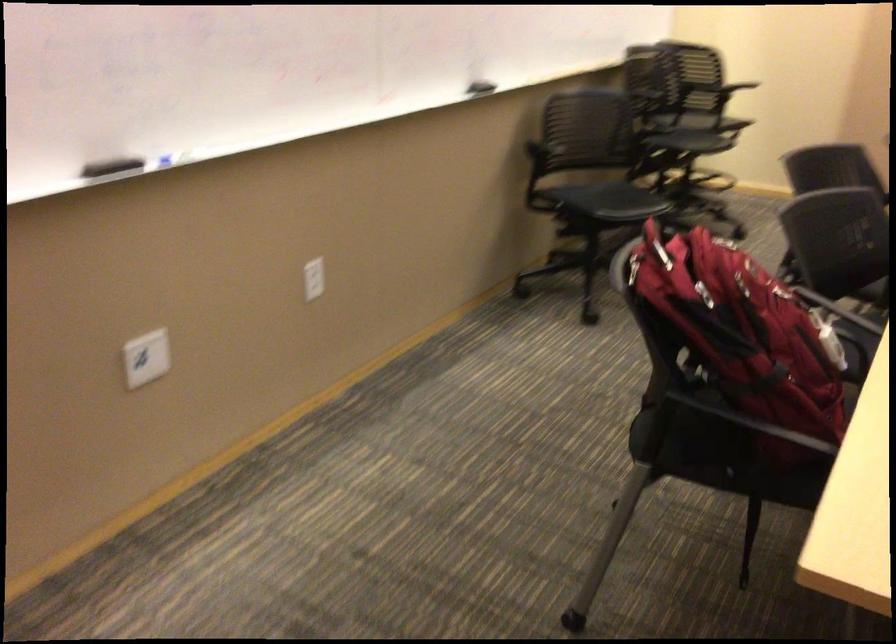
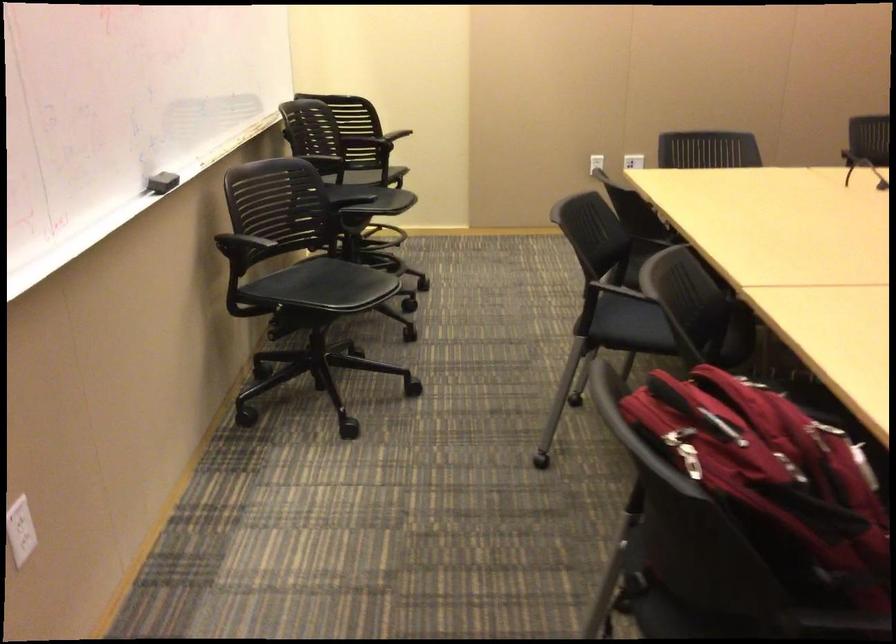
Locate, in the second image, the point that corresponds to point (716, 296) in the first image.

(773, 480)